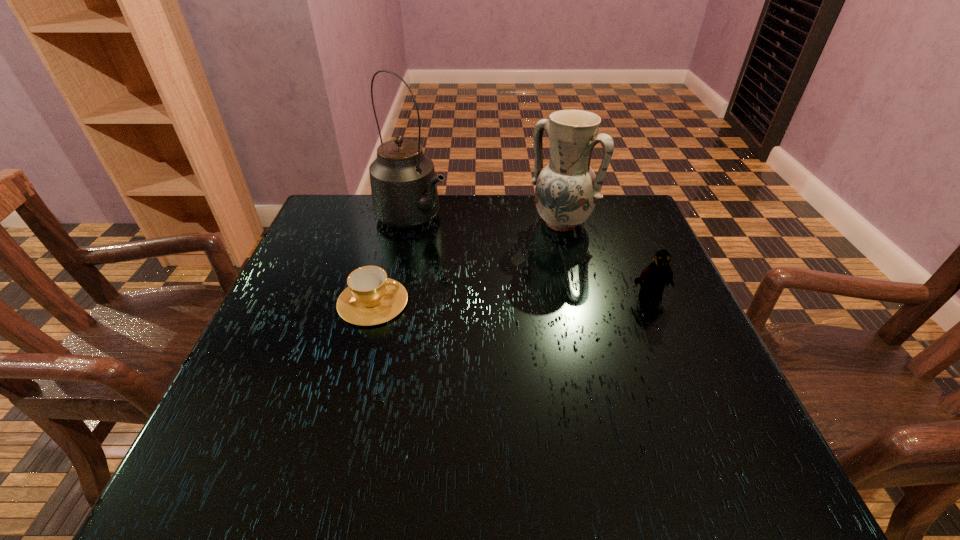
Find the location of a particular element. vacant space situated 0.300m on either side of the second tallest object is located at coordinates (483, 305).

This screenshot has width=960, height=540. Identify the location of blank area located 0.320m spout on the tallest object. (533, 291).

At what (x,y) coordinates should I click in order to perform the action: click on vacant area situated spout on the tallest object. Please return your answer as a coordinate pair (x, y). Looking at the image, I should click on (506, 275).

The width and height of the screenshot is (960, 540). What are the coordinates of `blank space located spout on the tallest object` in the screenshot? It's located at (461, 248).

I want to click on pottery that is at the far edge, so click(567, 189).

This screenshot has height=540, width=960. Identify the location of kettle present at the far edge. (404, 191).

Identify the location of cup that is at the left edge. The height and width of the screenshot is (540, 960). (371, 298).

I want to click on kettle that is at the left edge, so click(404, 191).

You are a GUI agent. You are given a task and a screenshot of the screen. Output one action in this format:
    pyautogui.click(x=<x>, y=<y>)
    Task: Click on the Lego positioned at the right edge
    This screenshot has height=540, width=960.
    Given the screenshot: What is the action you would take?
    pyautogui.click(x=656, y=275)

The width and height of the screenshot is (960, 540). What are the coordinates of `pottery at the right edge` in the screenshot? It's located at (567, 189).